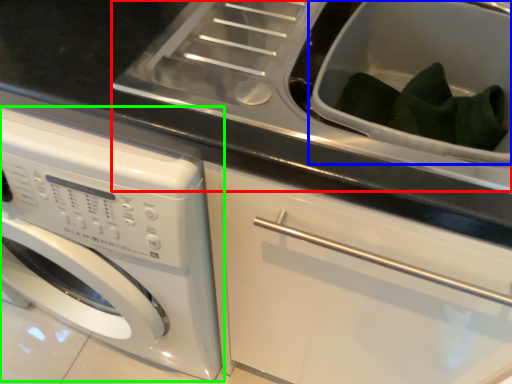
Question: Which is farther away from sink (highlighted by a red box)? sink (highlighted by a blue box) or washing machine (highlighted by a green box)?

Choices:
 (A) sink
 (B) washing machine

Answer: (B)